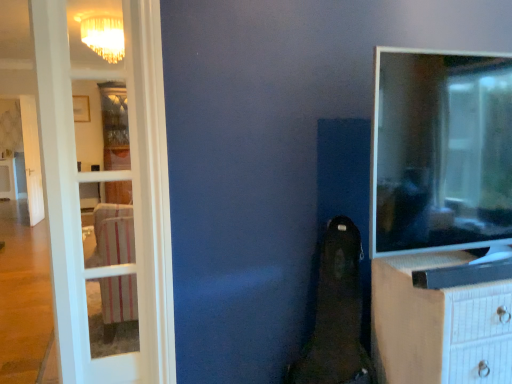
What do you see at coordinates (106, 180) in the screenshot? I see `white glass door at left` at bounding box center [106, 180].

Identify the location of white textured chest of drawers at right. (439, 325).

Would you say white glass door at left is inside or outside matte black tv at right?

white glass door at left is not enclosed by matte black tv at right.

From the image's perspective, is white glass door at left on top of matte black tv at right?

Actually, white glass door at left appears below matte black tv at right in the image.

Are white glass door at left and matte black tv at right beside each other?

No, white glass door at left is not in contact with matte black tv at right.

Who is shorter, white glass door at left or matte black tv at right?

With less height is matte black tv at right.

Can you confirm if white textured chest of drawers at right is wider than matte black tv at right?

Indeed, white textured chest of drawers at right has a greater width compared to matte black tv at right.

From the picture: From the image's perspective, is white textured chest of drawers at right above or below matte black tv at right?

From the image's perspective, white textured chest of drawers at right appears below matte black tv at right.

Does point (456, 308) come farther from viewer compared to point (467, 125)?

No, (456, 308) is in front of (467, 125).

Considering the sizes of objects white textured chest of drawers at right and matte black tv at right in the image provided, who is shorter, white textured chest of drawers at right or matte black tv at right?

Standing shorter between the two is matte black tv at right.

Can you tell me how much white glass door at left and white textured chest of drawers at right differ in facing direction?

There is a 6.78-degree angle between the facing directions of white glass door at left and white textured chest of drawers at right.

Considering the sizes of objects white glass door at left and white textured chest of drawers at right in the image provided, who is taller, white glass door at left or white textured chest of drawers at right?

white glass door at left.

Considering the relative sizes of white glass door at left and white textured chest of drawers at right in the image provided, is white glass door at left thinner than white textured chest of drawers at right?

Indeed, white glass door at left has a lesser width compared to white textured chest of drawers at right.

Between white glass door at left and white textured chest of drawers at right, which one appears on the right side from the viewer's perspective?

From the viewer's perspective, white textured chest of drawers at right appears more on the right side.

Between matte black tv at right and white glass door at left, which one is positioned behind?

white glass door at left is further away from the camera.

From the picture: Can you confirm if matte black tv at right is wider than white glass door at left?

In fact, matte black tv at right might be narrower than white glass door at left.

Looking at this image, from the image's perspective, would you say matte black tv at right is shown under white glass door at left?

No, from the image's perspective, matte black tv at right is not below white glass door at left.

Who is smaller, matte black tv at right or white glass door at left?

Smaller between the two is matte black tv at right.

Based on their positions, is matte black tv at right located to the left or right of white textured chest of drawers at right?

From the image, it's evident that matte black tv at right is to the left of white textured chest of drawers at right.

Does point (422, 168) appear closer or farther from the camera than point (473, 315)?

Point (422, 168) is positioned farther from the camera compared to point (473, 315).

Is matte black tv at right positioned beyond the bounds of white textured chest of drawers at right?

matte black tv at right is positioned outside white textured chest of drawers at right.

Is white textured chest of drawers at right not close to white glass door at left?

No.

Consider the image. Does white textured chest of drawers at right appear on the right side of white glass door at left?

Indeed, white textured chest of drawers at right is positioned on the right side of white glass door at left.

Can you confirm if white textured chest of drawers at right is wider than white glass door at left?

Yes.

From a real-world perspective, which object stands above the other?

In real-world perspective, white glass door at left is above.

This screenshot has width=512, height=384. In order to click on tv show located above the white glass door at left (from the image's perspective) in this screenshot , I will do click(x=441, y=151).

Identify the location of chest of drawers that is on the right side of matte black tv at right. (439, 325).

When comparing their distances from white textured chest of drawers at right, does white glass door at left or matte black tv at right seem further?

The object further to white textured chest of drawers at right is white glass door at left.

When comparing their distances from matte black tv at right, does white textured chest of drawers at right or white glass door at left seem closer?

white textured chest of drawers at right is positioned closer to the anchor matte black tv at right.

Based on their spatial positions, is white glass door at left or white textured chest of drawers at right closer to matte black tv at right?

Based on the image, white textured chest of drawers at right appears to be nearer to matte black tv at right.

Which object lies further to the anchor point white textured chest of drawers at right, matte black tv at right or white glass door at left?

white glass door at left is further to white textured chest of drawers at right.

From the image, which object appears to be nearer to white glass door at left, white textured chest of drawers at right or matte black tv at right?

Based on the image, matte black tv at right appears to be nearer to white glass door at left.

From the image, which object appears to be farther from white glass door at left, matte black tv at right or white textured chest of drawers at right?

The object further to white glass door at left is white textured chest of drawers at right.

Locate an element on the screen. tv show between white glass door at left and white textured chest of drawers at right in the horizontal direction is located at coordinates (441, 151).